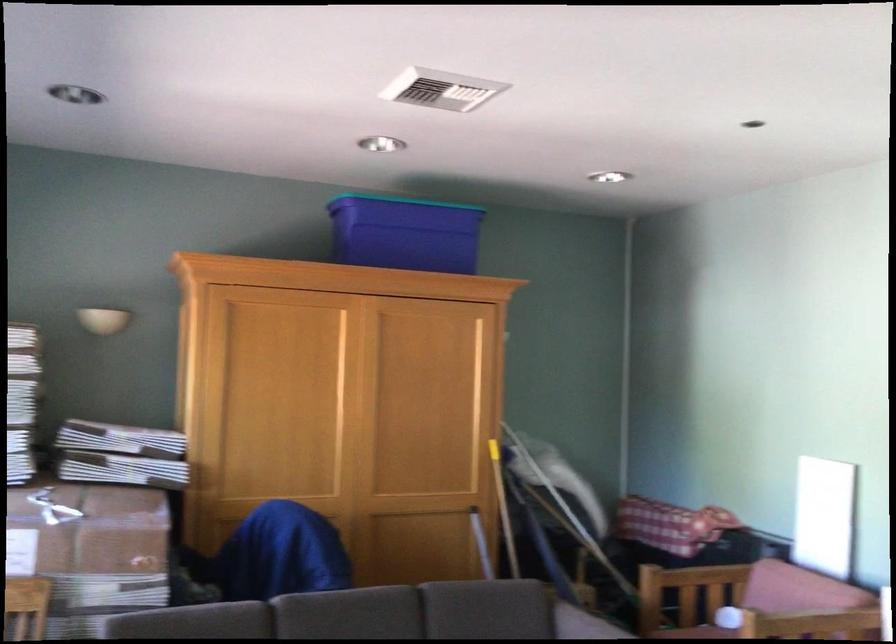
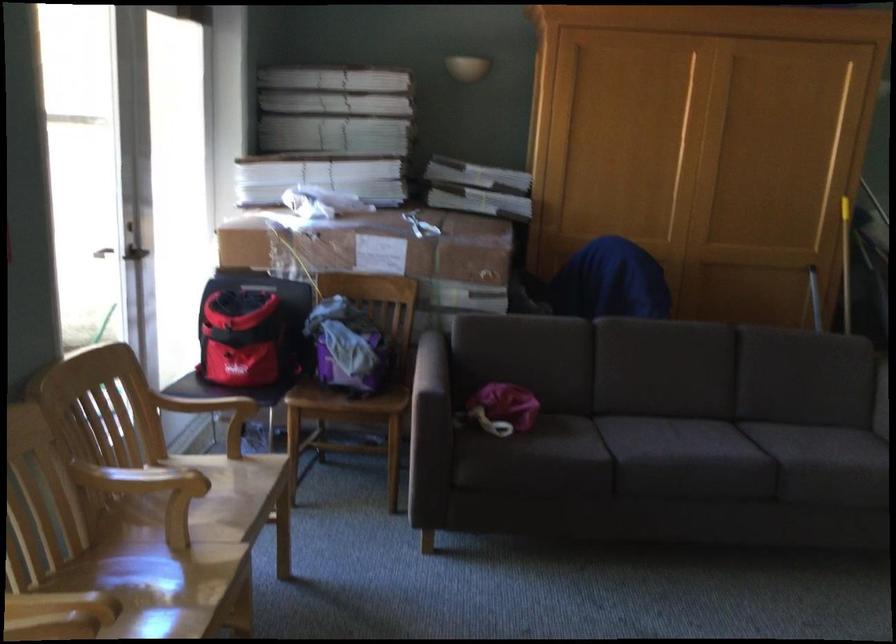
Question: In a continuous first-person perspective shot, in which direction is the camera moving?

Choices:
 (A) Left
 (B) Right
 (C) Forward
 (D) Backward

Answer: (D)